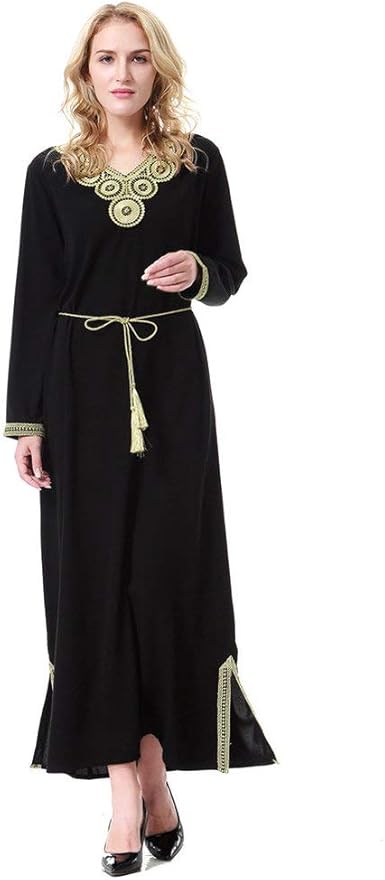
Locate an element on the screen. The width and height of the screenshot is (385, 880). gold trim is located at coordinates (206, 280), (229, 705), (25, 429).